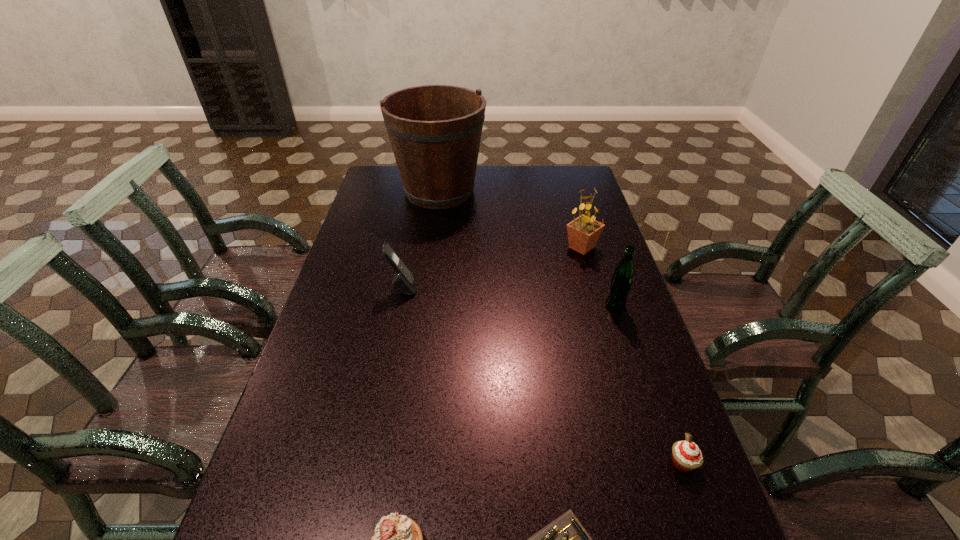
Where is `object that is at the far left corner`? The width and height of the screenshot is (960, 540). object that is at the far left corner is located at coordinates (435, 131).

In the image, there is a desktop. Find the location of `free space at the far edge`. free space at the far edge is located at coordinates (535, 169).

This screenshot has height=540, width=960. Identify the location of free region at the left edge of the desktop. (332, 286).

I want to click on vacant region at the right edge of the desktop, so pos(636,314).

In order to click on vacant point located between the cellular telephone and the fourth farthest object in this screenshot , I will do click(x=509, y=296).

This screenshot has height=540, width=960. Find the location of `vacant space that is in between the second shortest object and the fourth nearest object`. vacant space that is in between the second shortest object and the fourth nearest object is located at coordinates (649, 384).

I want to click on free space between the sixth nearest object and the farthest object, so click(511, 219).

Locate an element on the screen. object that is the closest to the tallest object is located at coordinates (583, 232).

I want to click on object that is the fifth closest to the bucket, so click(x=565, y=539).

Image resolution: width=960 pixels, height=540 pixels. In order to click on free space that satisfies the following two spatial constraints: 1. at the front of the beer bottle with flowers visible; 2. on the right side of the sunflower in this screenshot , I will do `click(598, 306)`.